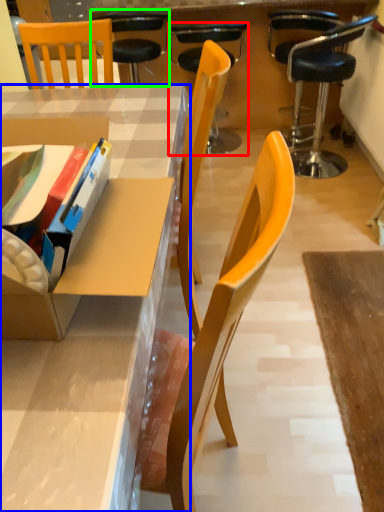
Question: Which is farther away from chair (highlighted by a red box)? desk (highlighted by a blue box) or chair (highlighted by a green box)?

Choices:
 (A) desk
 (B) chair

Answer: (A)